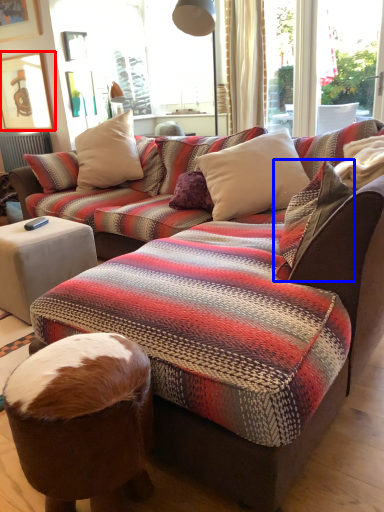
Question: Which object appears closest to the camera in this image, picture frame (highlighted by a red box) or pillow (highlighted by a blue box)?

Choices:
 (A) picture frame
 (B) pillow

Answer: (B)